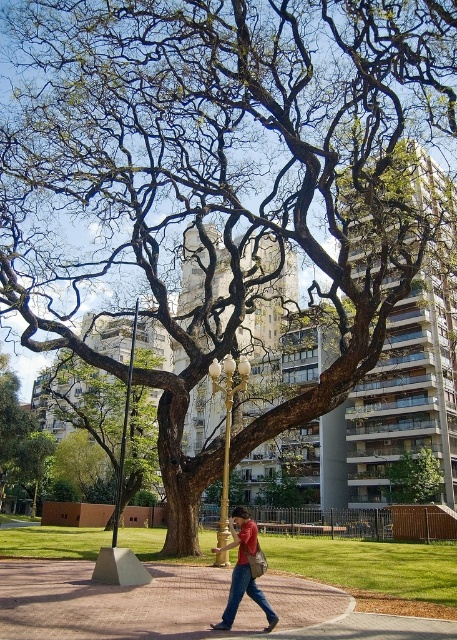
Does matte red shirt at center have a smaller size compared to green leafy tree at center?

Correct, matte red shirt at center occupies less space than green leafy tree at center.

Can you confirm if matte red shirt at center is bigger than green leafy tree at center?

No, matte red shirt at center is not bigger than green leafy tree at center.

Is point (239, 557) closer to viewer compared to point (441, 474)?

Yes, it is in front of point (441, 474).

Image resolution: width=457 pixels, height=640 pixels. I want to click on matte red shirt at center, so click(243, 570).

Which is in front, point (107, 445) or point (250, 548)?

Point (250, 548) is in front.

Where is `smooth brown tree trunk at center`? The height and width of the screenshot is (640, 457). smooth brown tree trunk at center is located at coordinates tap(84, 401).

The height and width of the screenshot is (640, 457). I want to click on smooth brown tree trunk at center, so click(x=84, y=401).

Who is positioned more to the right, paved brick sidewalk at center or green leafy tree at center?

From the viewer's perspective, green leafy tree at center appears more on the right side.

Does paved brick sidewalk at center have a smaller size compared to green leafy tree at center?

No.

The image size is (457, 640). I want to click on paved brick sidewalk at center, so click(x=107, y=602).